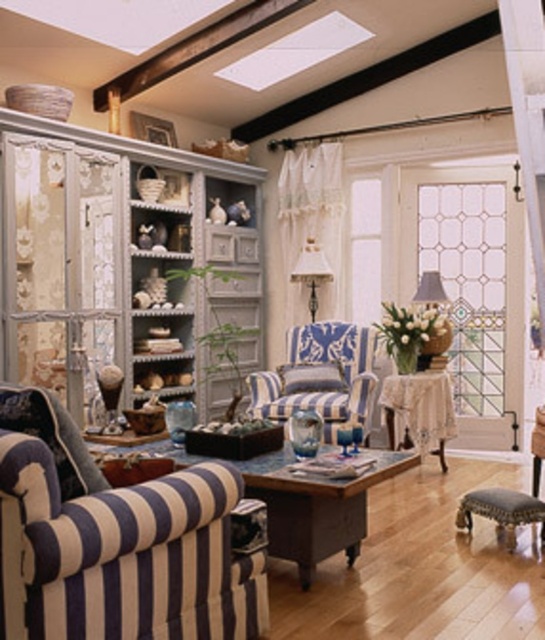
You are a guest entering the living room and want to sit down. You see the blue striped fabric couch at lower left and the dark brown leather stool at lower right. Which one is closer to the entrance?

The blue striped fabric couch at lower left is closer to the entrance because it is in front of the dark brown leather stool at lower right, indicating it is nearer to the entrance.

You are taking a photo of the living room and want to focus on both point (x=3, y=397) and point (x=511, y=509). Which point should you adjust your camera focus to first to ensure both are in focus?

Point (x=3, y=397) is closer to the camera than point (x=511, y=509), so you should focus on point (x=3, y=397) first to ensure both points are in focus.